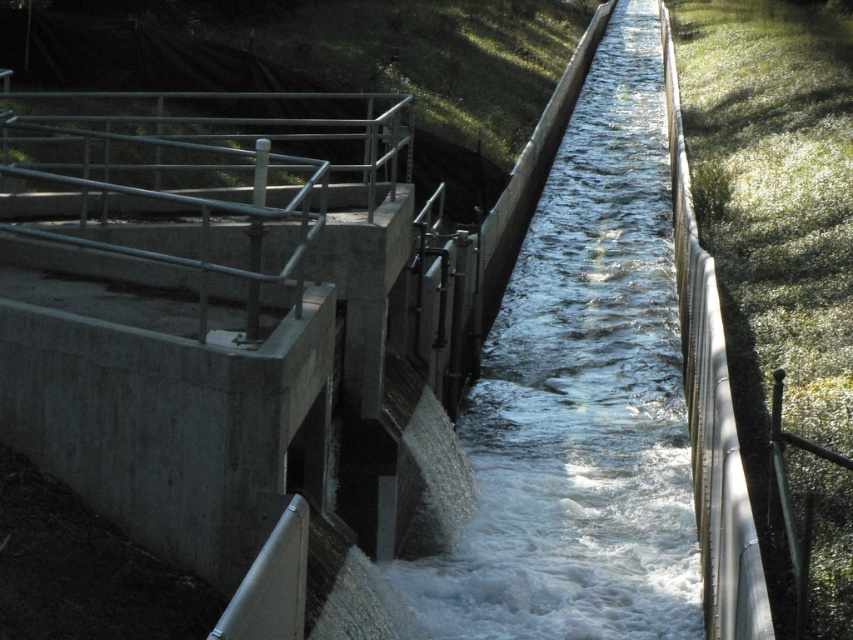
You are standing on the raised concrete platform with a metal railing on the left side of the image. You want to observe the clear water at center. In which direction should you look relative to your position?

You should look towards the center of the image from your position on the raised concrete platform on the left side. The clear water at center is located at point coordinates approximately (x=581, y=396), so you would need to look to your right and forward to see it.

You are a maintenance worker standing on the platform. You need to check the water level in the channel. Which object, the clear water at center or the metallic silver rail at right, is higher in elevation?

The clear water at center has a greater height compared to the metallic silver rail at right, so the water is higher in elevation.

You are a maintenance worker needing to cross from the platform to the channel. The metallic silver rail at right is on your right side. Which direction should you move to reach the clear water at center?

You should move to your left to reach the clear water at center since it is positioned to the left of the metallic silver rail at right.